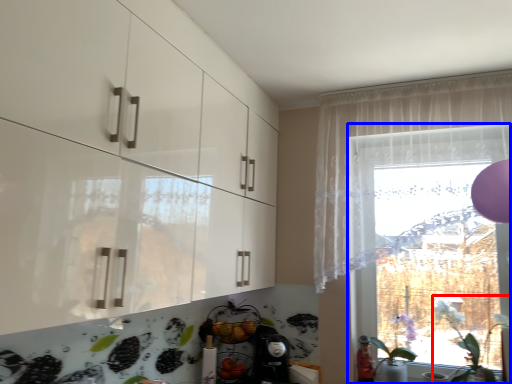
Question: Which object is closer to the camera taking this photo, plant (highlighted by a red box) or window (highlighted by a blue box)?

Choices:
 (A) plant
 (B) window

Answer: (A)